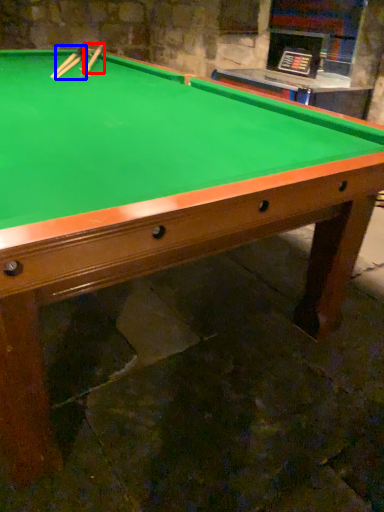
Question: Which object appears closest to the camera in this image, cue (highlighted by a red box) or cue (highlighted by a blue box)?

Choices:
 (A) cue
 (B) cue

Answer: (B)